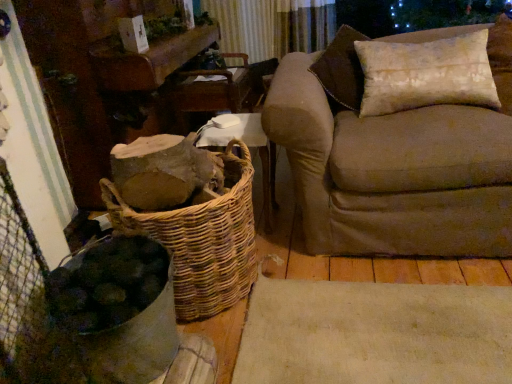
Question: From a real-world perspective, relative to wooden armchair at center, is beige fabric couch at right vertically above or below?

Choices:
 (A) below
 (B) above

Answer: (B)

Question: Relative to wooden armchair at center, is beige fabric couch at right in front or behind?

Choices:
 (A) behind
 (B) front

Answer: (B)

Question: Estimate the real-world distances between objects in this image. Which object is farther from the textured beige pillow at upper right?

Choices:
 (A) beige fabric couch at right
 (B) woven wood basket at center
 (C) wooden armchair at center
 (D) woven brown basket at lower left

Answer: (C)

Question: Based on their relative distances, which object is nearer to the wooden armchair at center?

Choices:
 (A) woven brown basket at lower left
 (B) textured beige pillow at upper right
 (C) beige fabric couch at right
 (D) woven wood basket at center

Answer: (D)